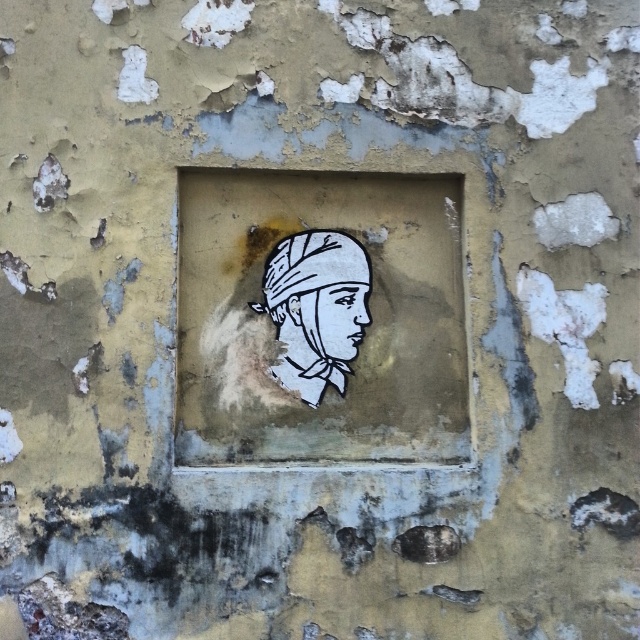
Can you confirm if white paper-like at center is positioned above white paper at center?

No.

Based on the photo, between white paper-like at center and white paper at center, which one appears on the right side from the viewer's perspective?

Positioned to the right is white paper-like at center.

The image size is (640, 640). Identify the location of white paper-like at center. (308, 330).

Between point (333, 337) and point (339, 324), which one is positioned behind?

Point (339, 324)

Who is more forward, (308,294) or (358,316)?

Point (308,294) is more forward.

Between point (371, 268) and point (336, 339), which one is positioned behind?

The point (371, 268) is more distant.

The height and width of the screenshot is (640, 640). Identify the location of white paper at center. (316, 308).

Can you confirm if white paper-like at center is taller than white paper-like face at center?

Yes.

This screenshot has width=640, height=640. Identify the location of white paper-like at center. (308, 330).

Identify the location of white paper-like at center. (308, 330).